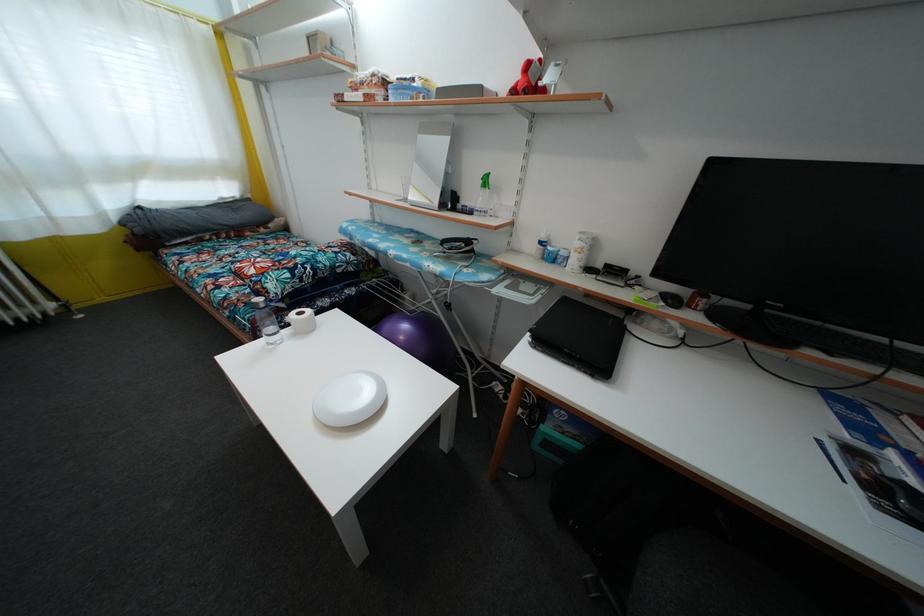
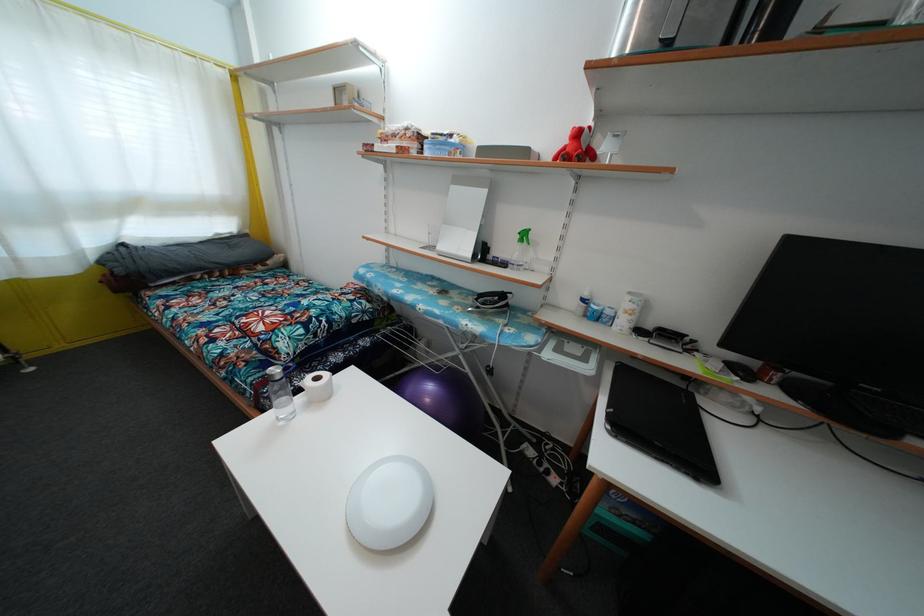
Question: The first image is from the beginning of the video and the second image is from the end. How did the camera likely rotate when shooting the video?

Choices:
 (A) Left
 (B) Right
 (C) Up
 (D) Down

Answer: (C)